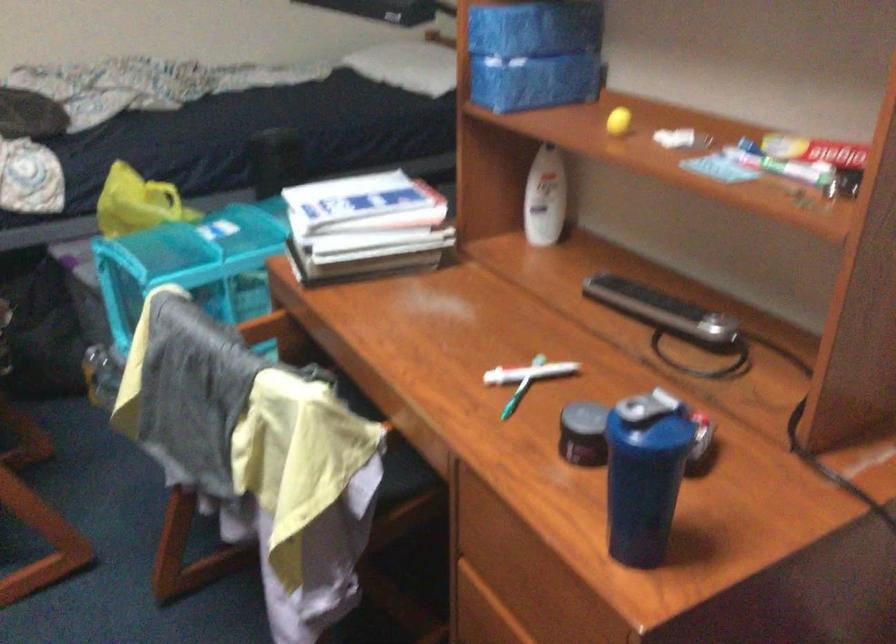
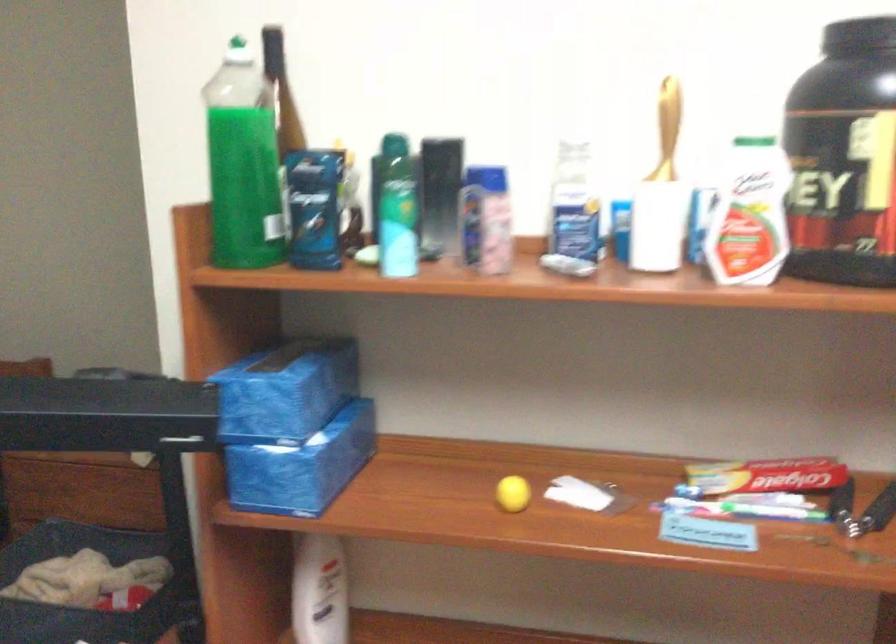
In the second image, find the point that corresponds to the point at 823,160 in the first image.

(764, 483)